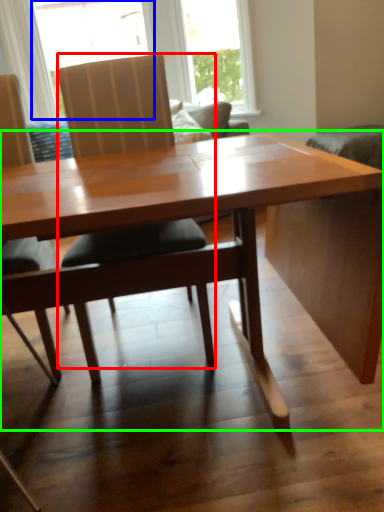
Question: Which object is the closest to the chair (highlighted by a red box)? Choose among these: window (highlighted by a blue box) or table (highlighted by a green box).

Choices:
 (A) window
 (B) table

Answer: (B)